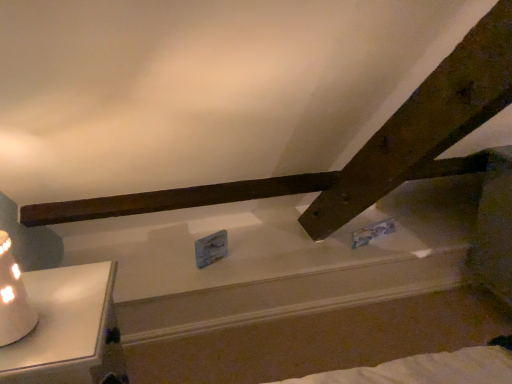
Question: Is white glossy candlestick at lower left closer to the viewer compared to white ceramic table lamp at lower left?

Choices:
 (A) yes
 (B) no

Answer: (B)

Question: Is white ceramic table lamp at lower left surrounded by white glossy candlestick at lower left?

Choices:
 (A) no
 (B) yes

Answer: (A)

Question: Is white glossy candlestick at lower left facing towards white ceramic table lamp at lower left?

Choices:
 (A) no
 (B) yes

Answer: (A)

Question: Considering the relative sizes of white glossy candlestick at lower left and white ceramic table lamp at lower left in the image provided, is white glossy candlestick at lower left thinner than white ceramic table lamp at lower left?

Choices:
 (A) yes
 (B) no

Answer: (B)

Question: Considering the relative sizes of white glossy candlestick at lower left and white ceramic table lamp at lower left in the image provided, is white glossy candlestick at lower left bigger than white ceramic table lamp at lower left?

Choices:
 (A) no
 (B) yes

Answer: (B)

Question: Can you confirm if white glossy candlestick at lower left is smaller than white ceramic table lamp at lower left?

Choices:
 (A) yes
 (B) no

Answer: (B)

Question: Can you confirm if white ceramic table lamp at lower left is taller than white glossy candlestick at lower left?

Choices:
 (A) no
 (B) yes

Answer: (A)

Question: Is white ceramic table lamp at lower left smaller than white glossy candlestick at lower left?

Choices:
 (A) no
 (B) yes

Answer: (B)

Question: From the image's perspective, is white ceramic table lamp at lower left below white glossy candlestick at lower left?

Choices:
 (A) no
 (B) yes

Answer: (A)

Question: Does white ceramic table lamp at lower left have a larger size compared to white glossy candlestick at lower left?

Choices:
 (A) yes
 (B) no

Answer: (B)

Question: Is white ceramic table lamp at lower left facing away from white glossy candlestick at lower left?

Choices:
 (A) no
 (B) yes

Answer: (A)

Question: Does white ceramic table lamp at lower left turn towards white glossy candlestick at lower left?

Choices:
 (A) no
 (B) yes

Answer: (A)

Question: From a real-world perspective, is white ceramic table lamp at lower left positioned above or below white glossy candlestick at lower left?

Choices:
 (A) below
 (B) above

Answer: (B)